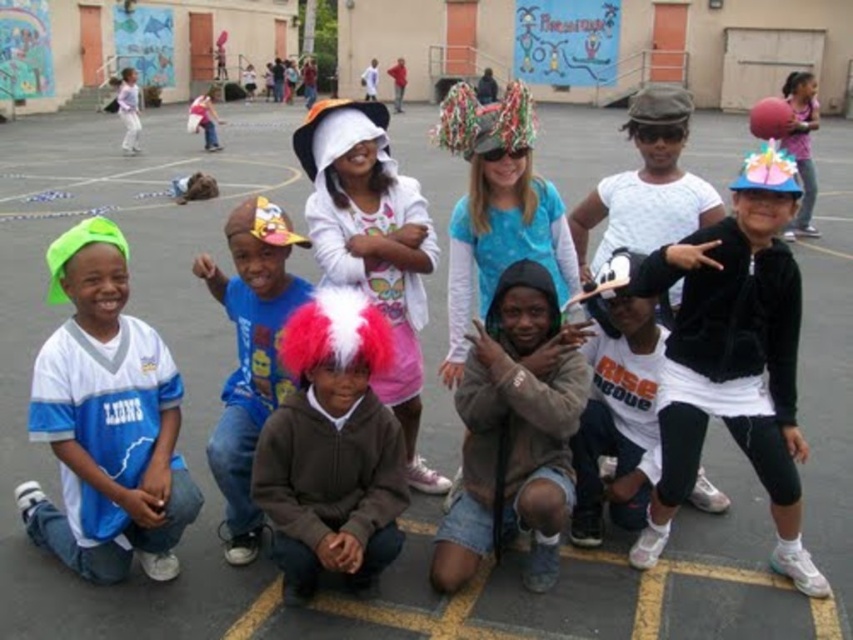
Question: Is neon green fabric hat at lower left bigger than white matte t-shirt at center?

Choices:
 (A) yes
 (B) no

Answer: (A)

Question: Is fuzzy pink wig at center below white cotton shirt at upper left?

Choices:
 (A) no
 (B) yes

Answer: (B)

Question: Among these points, which one is nearest to the camera?

Choices:
 (A) pos(119,92)
 (B) pos(376,426)
 (C) pos(672,353)
 (D) pos(236,268)

Answer: (B)

Question: Which is nearer to the fuzzy pink wig at center?

Choices:
 (A) matte pink shirt at upper right
 (B) white cotton hoodie at upper center
 (C) white matte t-shirt at center
 (D) white cotton shirt at upper left

Answer: (C)

Question: Which of the following is the farthest from the observer?

Choices:
 (A) (218, 115)
 (B) (102, 548)

Answer: (A)

Question: Is fuzzy pink wig at center to the left of white cotton shirt at upper left from the viewer's perspective?

Choices:
 (A) no
 (B) yes

Answer: (A)